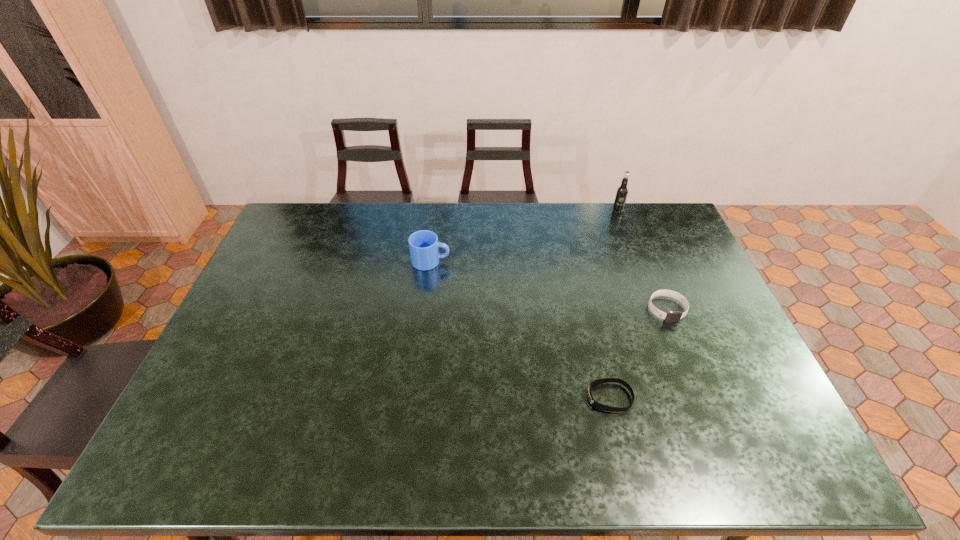
Where is `the tallest object`? Image resolution: width=960 pixels, height=540 pixels. the tallest object is located at coordinates (622, 191).

The image size is (960, 540). In order to click on root beer in this screenshot , I will do click(x=622, y=191).

What are the coordinates of `the leftmost object` in the screenshot? It's located at (424, 247).

I want to click on the second farthest object, so click(424, 247).

Find the location of `the right wristband`. the right wristband is located at coordinates (671, 316).

Where is `the third farthest object`? This screenshot has width=960, height=540. the third farthest object is located at coordinates pos(671,316).

Image resolution: width=960 pixels, height=540 pixels. In order to click on the nearest object in this screenshot , I will do `click(595, 404)`.

Locate an element on the screen. Image resolution: width=960 pixels, height=540 pixels. the second object from left to right is located at coordinates (595, 404).

Find the location of `vacant space located on the label of the root beer`. vacant space located on the label of the root beer is located at coordinates click(636, 258).

Locate an element on the screen. free space located on the side of the third shortest object with the handle is located at coordinates (568, 261).